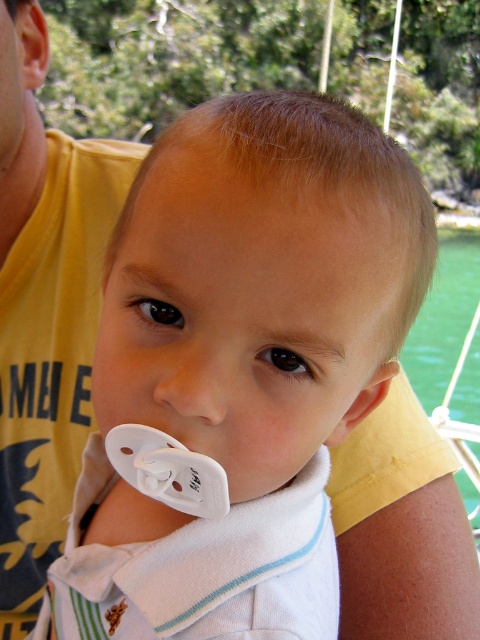
You are a photographer adjusting the focus on your camera. You want to ensure both the white plastic pacifier at center and the green water at lower right are in focus. Which object should you focus on first to achieve this?

The white plastic pacifier at center is positioned on the left side of green water at lower right. To ensure both are in focus, you should focus on the white plastic pacifier at center first, as it is closer to the camera, and then adjust for the green water at lower right.

You are a photographer trying to capture a close shot of the child while ensuring both the white plastic pacifier at center and the green water at lower right are visible. Which object takes up more space in the frame?

The green water at lower right takes up more space in the frame than the white plastic pacifier at center because the pacifier occupies less space than the water.

You are holding a 50 cm long ruler. You want to measure the distance from your eyes to the point at coordinate point (91, 557) in the image. Can you reach the point with your ruler?

The distance between point (91, 557) and the viewer is 49.19 centimeters, so yes, the ruler can reach the point since it is shorter than the ruler length.